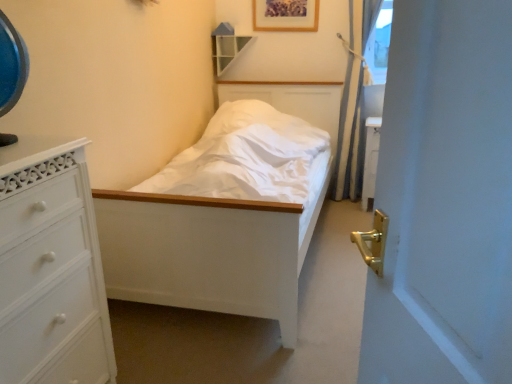
Question: Is wooden shelf at upper center completely or partially outside of white painted wood chest of drawers at left?

Choices:
 (A) yes
 (B) no

Answer: (A)

Question: Considering the relative positions of wooden shelf at upper center and white painted wood chest of drawers at left in the image provided, is wooden shelf at upper center in front of white painted wood chest of drawers at left?

Choices:
 (A) no
 (B) yes

Answer: (A)

Question: Is wooden shelf at upper center positioned with its back to white painted wood chest of drawers at left?

Choices:
 (A) no
 (B) yes

Answer: (A)

Question: Considering the relative sizes of wooden shelf at upper center and white painted wood chest of drawers at left in the image provided, is wooden shelf at upper center smaller than white painted wood chest of drawers at left?

Choices:
 (A) no
 (B) yes

Answer: (B)

Question: Is wooden shelf at upper center far from white painted wood chest of drawers at left?

Choices:
 (A) yes
 (B) no

Answer: (A)

Question: From their relative heights in the image, would you say wooden picture frame at upper center is taller or shorter than wooden shelf at upper center?

Choices:
 (A) tall
 (B) short

Answer: (B)

Question: From a real-world perspective, relative to wooden shelf at upper center, is wooden picture frame at upper center vertically above or below?

Choices:
 (A) below
 (B) above

Answer: (B)

Question: Looking at the image, does wooden picture frame at upper center seem bigger or smaller compared to wooden shelf at upper center?

Choices:
 (A) small
 (B) big

Answer: (A)

Question: Which is correct: wooden picture frame at upper center is inside wooden shelf at upper center, or outside of it?

Choices:
 (A) outside
 (B) inside

Answer: (A)

Question: Is white painted wood chest of drawers at left inside or outside of wooden shelf at upper center?

Choices:
 (A) inside
 (B) outside

Answer: (B)

Question: Based on their positions, is white painted wood chest of drawers at left located to the left or right of wooden shelf at upper center?

Choices:
 (A) right
 (B) left

Answer: (B)

Question: Considering the positions of white painted wood chest of drawers at left and wooden shelf at upper center in the image, is white painted wood chest of drawers at left wider or thinner than wooden shelf at upper center?

Choices:
 (A) thin
 (B) wide

Answer: (B)

Question: From the image's perspective, is white painted wood chest of drawers at left located above or below wooden shelf at upper center?

Choices:
 (A) below
 (B) above

Answer: (A)

Question: Is wooden picture frame at upper center in front of or behind blue fabric curtain at right in the image?

Choices:
 (A) front
 (B) behind

Answer: (B)

Question: From the image's perspective, is wooden picture frame at upper center positioned above or below blue fabric curtain at right?

Choices:
 (A) below
 (B) above

Answer: (B)